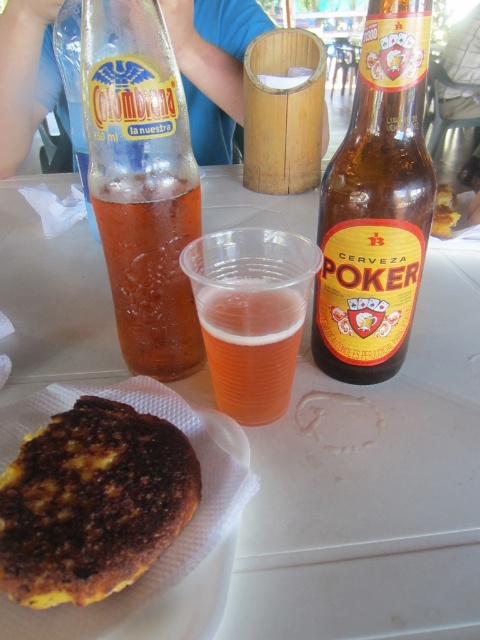
Who is higher up, white plastic table at center or golden-brown crispy bread at lower left?

Positioned higher is white plastic table at center.

Is point (14, 179) in front of point (63, 589)?

No, it is not.

You are a GUI agent. You are given a task and a screenshot of the screen. Output one action in this format:
    pyautogui.click(x=<x>, y=<y>)
    Task: Click on the white plastic table at center
    The width and height of the screenshot is (480, 640).
    Given the screenshot: What is the action you would take?
    pyautogui.click(x=372, y=488)

Is white plastic table at center below brown glass bottle at upper center?

No.

Can you confirm if white plastic table at center is positioned above brown glass bottle at upper center?

Yes.

Is point (296, 636) positioned before point (399, 77)?

Yes, it is in front of point (399, 77).

This screenshot has height=640, width=480. What are the coordinates of `white plastic table at center` in the screenshot? It's located at (372, 488).

Who is positioned more to the left, translucent glass bottle at upper left or golden-brown crispy bread at lower left?

golden-brown crispy bread at lower left

Which is above, translucent glass bottle at upper left or golden-brown crispy bread at lower left?

translucent glass bottle at upper left is above.

Who is more forward, (81, 67) or (126, 566)?

Point (126, 566) is more forward.

Where is `translucent glass bottle at upper left`? The width and height of the screenshot is (480, 640). translucent glass bottle at upper left is located at coordinates (142, 182).